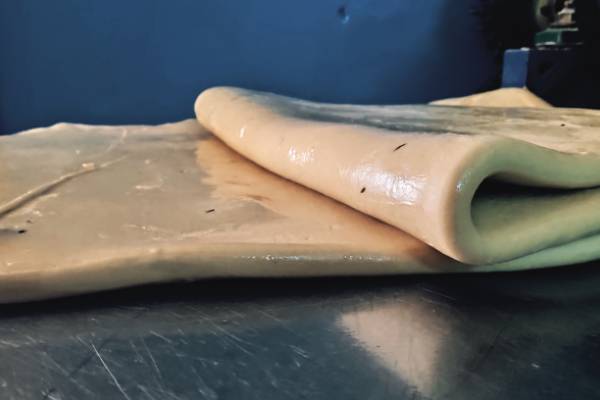
Locate an element on the screen. white scratch on stainless steel counter top is located at coordinates (111, 377).